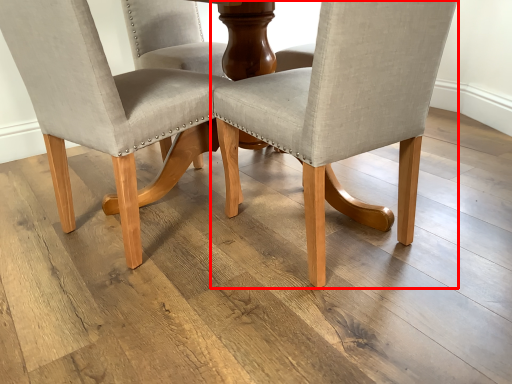
Question: Considering the relative positions of chair (annotated by the red box) and chair in the image provided, where is chair (annotated by the red box) located with respect to the staircase?

Choices:
 (A) left
 (B) right

Answer: (B)